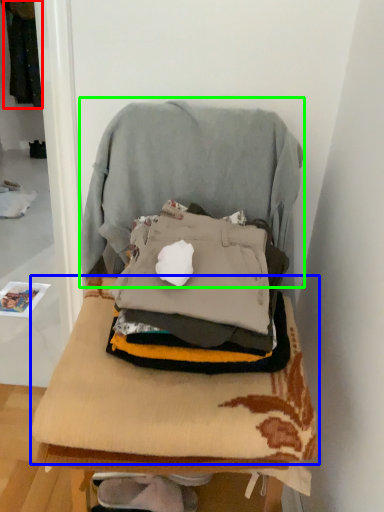
Question: Based on their relative distances, which object is nearer to clothing (highlighted by a red box)? Choose from blanket (highlighted by a blue box) and swivel chair (highlighted by a green box).

Choices:
 (A) blanket
 (B) swivel chair

Answer: (B)